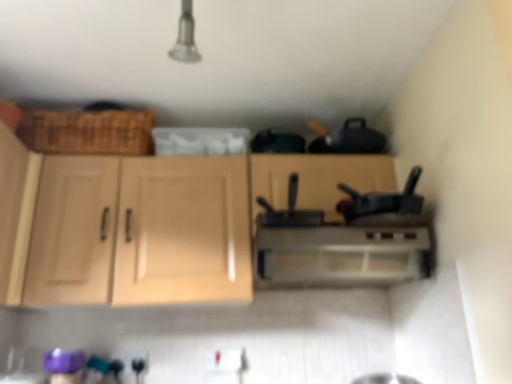
Identify the location of light wood cabinet at left, which is the 2th cabinetry in right-to-left order. This screenshot has height=384, width=512. (15, 211).

Image resolution: width=512 pixels, height=384 pixels. I want to click on light wood cabinet at left, which is the 2th cabinetry in right-to-left order, so click(15, 211).

Is light wood cabinet at left, which is the 2th cabinetry in right-to-left order, facing away from black matte pan at center?

No, light wood cabinet at left, which is the 2th cabinetry in right-to-left order,'s orientation is not away from black matte pan at center.

From the image's perspective, between light wood cabinet at left, which is the 2th cabinetry in right-to-left order, and black matte pan at center, which one is located above?

black matte pan at center.

Which point is more distant from viewer, (13, 162) or (307, 214)?

The point (13, 162) is behind.

Which of these two, black matte pan at center or light wood cabinet at left, which is the 2th cabinetry in right-to-left order, is smaller?

Smaller between the two is black matte pan at center.

Does point (321, 219) come farther from viewer compared to point (8, 264)?

No, (321, 219) is in front of (8, 264).

From the image's perspective, which one is positioned lower, black matte pan at center or light wood cabinet at left, the 1th cabinetry from the left?

light wood cabinet at left, the 1th cabinetry from the left, is shown below in the image.

Find the location of a particular element. This screenshot has height=384, width=512. cabinetry that is the 2nd object to the left of the black matte pan at center, starting at the anchor is located at coordinates (15, 211).

From the image's perspective, is satin silver range hood at center on light wood cabinet at center, positioned as the 2th cabinetry in left-to-right order?

No, from the image's perspective, satin silver range hood at center is not on top of light wood cabinet at center, positioned as the 2th cabinetry in left-to-right order.

Is satin silver range hood at center positioned with its back to light wood cabinet at center, positioned as the 2th cabinetry in left-to-right order?

Absolutely, satin silver range hood at center is directed away from light wood cabinet at center, positioned as the 2th cabinetry in left-to-right order.

Considering the relative positions of satin silver range hood at center and light wood cabinet at center, positioned as the 2th cabinetry in left-to-right order, in the image provided, is satin silver range hood at center to the right of light wood cabinet at center, positioned as the 2th cabinetry in left-to-right order, from the viewer's perspective?

Yes.

Which is closer to the camera, [155,247] or [6,176]?

The point [6,176] is more forward.

Can you confirm if light wood cabinet at center, positioned as the 2th cabinetry in left-to-right order, is shorter than light wood cabinet at left, which is the 2th cabinetry in right-to-left order?

No, light wood cabinet at center, positioned as the 2th cabinetry in left-to-right order, is not shorter than light wood cabinet at left, which is the 2th cabinetry in right-to-left order.

Is light wood cabinet at center, the 1th cabinetry in the right-to-left sequence, positioned with its back to light wood cabinet at left, the 1th cabinetry from the left?

No, light wood cabinet at center, the 1th cabinetry in the right-to-left sequence,'s orientation is not away from light wood cabinet at left, the 1th cabinetry from the left.

How many degrees apart are the facing directions of light wood cabinet at center, positioned as the 2th cabinetry in left-to-right order, and light wood cabinet at left, which is the 2th cabinetry in right-to-left order?

The facing directions of light wood cabinet at center, positioned as the 2th cabinetry in left-to-right order, and light wood cabinet at left, which is the 2th cabinetry in right-to-left order, are 90.1 degrees apart.

Identify the location of cabinetry that is the 1st object above the black matte pan at center (from a real-world perspective). This screenshot has width=512, height=384. (140, 231).

Considering the relative sizes of black matte pan at center and light wood cabinet at center, the 1th cabinetry in the right-to-left sequence, in the image provided, is black matte pan at center taller than light wood cabinet at center, the 1th cabinetry in the right-to-left sequence,?

Incorrect, the height of black matte pan at center is not larger of that of light wood cabinet at center, the 1th cabinetry in the right-to-left sequence.

Which is closer to the camera, (283, 224) or (233, 196)?

Point (283, 224) appears to be closer to the viewer than point (233, 196).

Which object is closer to the camera, black matte pan at center or light wood cabinet at center, the 1th cabinetry in the right-to-left sequence?

black matte pan at center is in front.

From a real-world perspective, is black matte pan at center located higher than satin silver range hood at center?

Yes, from a real-world perspective, black matte pan at center is on top of satin silver range hood at center.

Considering the positions of objects black matte pan at center and satin silver range hood at center in the image provided, who is behind, black matte pan at center or satin silver range hood at center?

satin silver range hood at center is further from the camera.

Is black matte pan at center with satin silver range hood at center?

No.

Does black matte pan at center turn towards satin silver range hood at center?

No, black matte pan at center is not oriented towards satin silver range hood at center.

Considering the positions of objects satin silver range hood at center and light wood cabinet at left, which is the 2th cabinetry in right-to-left order, in the image provided, who is in front, satin silver range hood at center or light wood cabinet at left, which is the 2th cabinetry in right-to-left order,?

Positioned in front is light wood cabinet at left, which is the 2th cabinetry in right-to-left order.

How many degrees apart are the facing directions of satin silver range hood at center and light wood cabinet at left, the 1th cabinetry from the left?

The facing directions of satin silver range hood at center and light wood cabinet at left, the 1th cabinetry from the left, are 88.9 degrees apart.

From a real-world perspective, which is physically below, satin silver range hood at center or light wood cabinet at left, which is the 2th cabinetry in right-to-left order?

From a 3D spatial view, satin silver range hood at center is below.

Does satin silver range hood at center turn towards light wood cabinet at left, which is the 2th cabinetry in right-to-left order?

No, satin silver range hood at center is not aimed at light wood cabinet at left, which is the 2th cabinetry in right-to-left order.

From the image's perspective, which cabinetry is the 1st one below the black matte pan at center? Please provide its 2D coordinates.

[(15, 211)]

Locate an element on the screen. The height and width of the screenshot is (384, 512). cabinetry that is the 2nd object above the black matte pan at center (from a real-world perspective) is located at coordinates (15, 211).

Looking at this image, from the image, which object appears to be nearer to satin silver range hood at center, light wood cabinet at center, positioned as the 2th cabinetry in left-to-right order, or light wood cabinet at left, the 1th cabinetry from the left?

light wood cabinet at center, positioned as the 2th cabinetry in left-to-right order, is closer to satin silver range hood at center.

Based on their spatial positions, is light wood cabinet at center, positioned as the 2th cabinetry in left-to-right order, or black matte pan at center closer to satin silver range hood at center?

The object closer to satin silver range hood at center is black matte pan at center.

Which object lies nearer to the anchor point light wood cabinet at left, which is the 2th cabinetry in right-to-left order, satin silver range hood at center or light wood cabinet at center, positioned as the 2th cabinetry in left-to-right order?

light wood cabinet at center, positioned as the 2th cabinetry in left-to-right order.

Estimate the real-world distances between objects in this image. Which object is further from black matte pan at center, light wood cabinet at center, the 1th cabinetry in the right-to-left sequence, or light wood cabinet at left, the 1th cabinetry from the left?

light wood cabinet at left, the 1th cabinetry from the left, is positioned further to the anchor black matte pan at center.

When comparing their distances from black matte pan at center, does satin silver range hood at center or light wood cabinet at left, which is the 2th cabinetry in right-to-left order, seem further?

The object further to black matte pan at center is light wood cabinet at left, which is the 2th cabinetry in right-to-left order.

From the image, which object appears to be nearer to satin silver range hood at center, light wood cabinet at left, the 1th cabinetry from the left, or black matte pan at center?

black matte pan at center is closer to satin silver range hood at center.

Estimate the real-world distances between objects in this image. Which object is closer to light wood cabinet at left, which is the 2th cabinetry in right-to-left order, black matte pan at center or light wood cabinet at center, the 1th cabinetry in the right-to-left sequence?

light wood cabinet at center, the 1th cabinetry in the right-to-left sequence, lies closer to light wood cabinet at left, which is the 2th cabinetry in right-to-left order, than the other object.

Which object lies further to the anchor point black matte pan at center, satin silver range hood at center or light wood cabinet at center, the 1th cabinetry in the right-to-left sequence?

light wood cabinet at center, the 1th cabinetry in the right-to-left sequence, lies further to black matte pan at center than the other object.

Identify the location of cabinetry between light wood cabinet at left, which is the 2th cabinetry in right-to-left order, and satin silver range hood at center, in the horizontal direction. (140, 231).

At what (x,y) coordinates should I click in order to perform the action: click on appliance between light wood cabinet at center, the 1th cabinetry in the right-to-left sequence, and satin silver range hood at center from left to right. Please return your answer as a coordinate pair (x, y). This screenshot has width=512, height=384. Looking at the image, I should click on (289, 211).

Find the location of a particular element. appliance between light wood cabinet at left, which is the 2th cabinetry in right-to-left order, and satin silver range hood at center, in the horizontal direction is located at coordinates (289, 211).

The width and height of the screenshot is (512, 384). In order to click on cabinetry situated between light wood cabinet at left, which is the 2th cabinetry in right-to-left order, and black matte pan at center from left to right in this screenshot , I will do `click(140, 231)`.